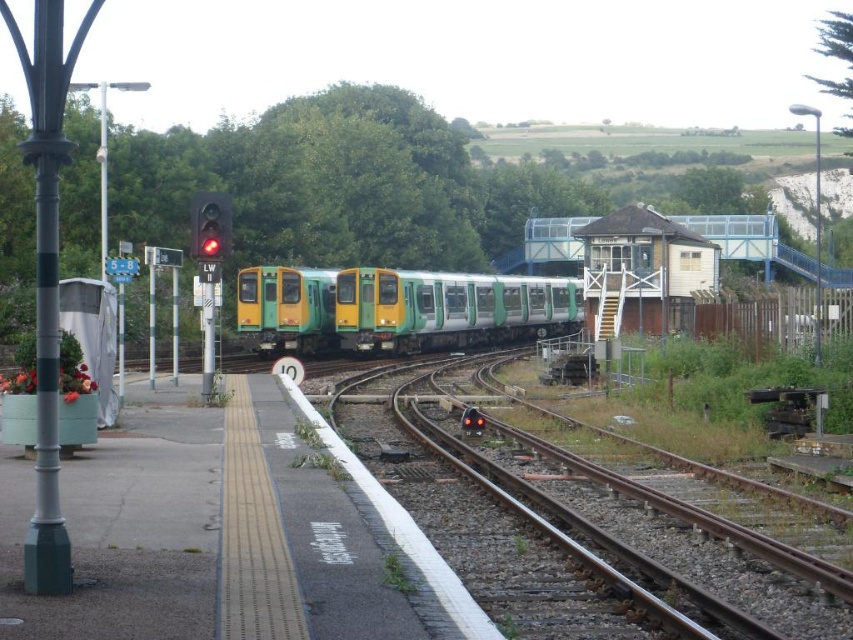
Is metal at center thinner than green metallic train at center?

Yes.

Between metal at center and green metallic train at center, which one appears on the right side from the viewer's perspective?

Positioned to the right is metal at center.

At what (x,y) coordinates should I click in order to perform the action: click on metal at center. Please return your answer as a coordinate pair (x, y). The width and height of the screenshot is (853, 640). Looking at the image, I should click on (660, 522).

Who is positioned more to the left, green metallic train at center or red glass traffic light at upper left?

red glass traffic light at upper left is more to the left.

Between point (328, 282) and point (223, 234), which one is positioned behind?

Point (328, 282)

Which is behind, point (257, 280) or point (202, 250)?

The point (257, 280) is more distant.

At what (x,y) coordinates should I click in order to perform the action: click on green metallic train at center. Please return your answer as a coordinate pair (x, y). This screenshot has height=640, width=853. Looking at the image, I should click on (397, 308).

Who is more forward, (283, 320) or (469, 419)?

Point (469, 419) is in front.

Is the position of green metallic train at center more distant than that of red glass traffic light at center?

Yes.

The height and width of the screenshot is (640, 853). What do you see at coordinates (397, 308) in the screenshot? I see `green metallic train at center` at bounding box center [397, 308].

Find the location of a particular element. green metallic train at center is located at coordinates (397, 308).